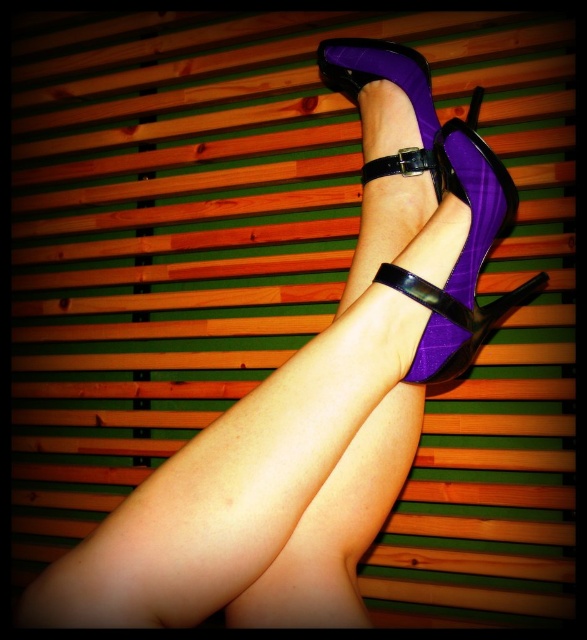
Question: Which object appears closest to the camera in this image?

Choices:
 (A) purple suede heels at center
 (B) purple suede sandal at center

Answer: (A)

Question: Where is purple suede heels at center located in relation to purple suede sandal at center in the image?

Choices:
 (A) below
 (B) above

Answer: (A)

Question: From the image, what is the correct spatial relationship of purple suede heels at center in relation to purple suede sandal at center?

Choices:
 (A) right
 (B) left

Answer: (B)

Question: Which point is closer to the camera taking this photo?

Choices:
 (A) (413, 116)
 (B) (494, 211)

Answer: (B)

Question: Is purple suede heels at center positioned in front of purple suede sandal at center?

Choices:
 (A) no
 (B) yes

Answer: (B)

Question: Which point is closer to the camera taking this photo?

Choices:
 (A) (312, 593)
 (B) (467, 140)

Answer: (A)